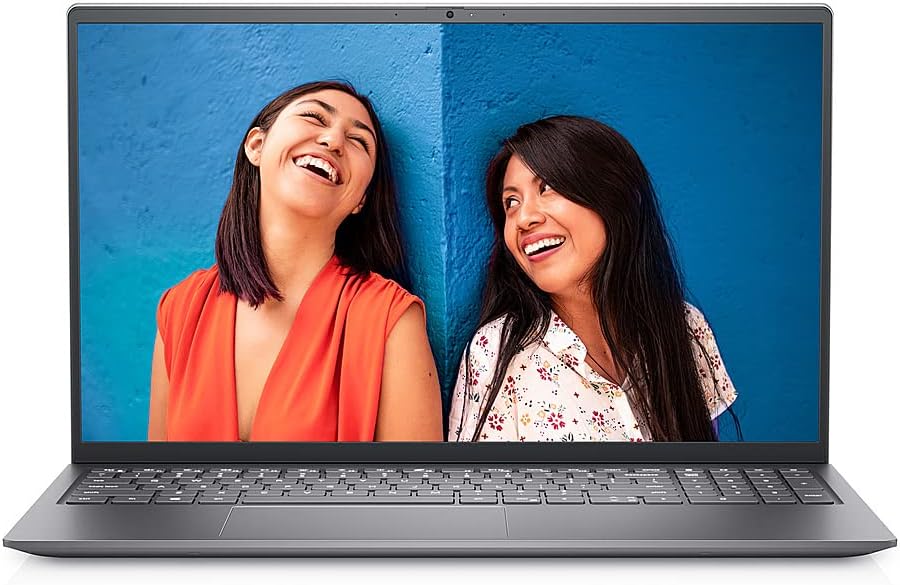
The width and height of the screenshot is (900, 585). Identify the location of keyboard. (340, 490), (527, 488), (204, 477), (757, 490).